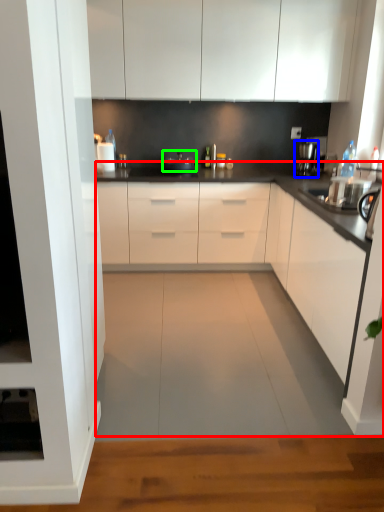
Question: Which is nearer to the countertop (highlighted by a red box)? coffee machine (highlighted by a blue box) or appliance (highlighted by a green box).

Choices:
 (A) coffee machine
 (B) appliance

Answer: (B)